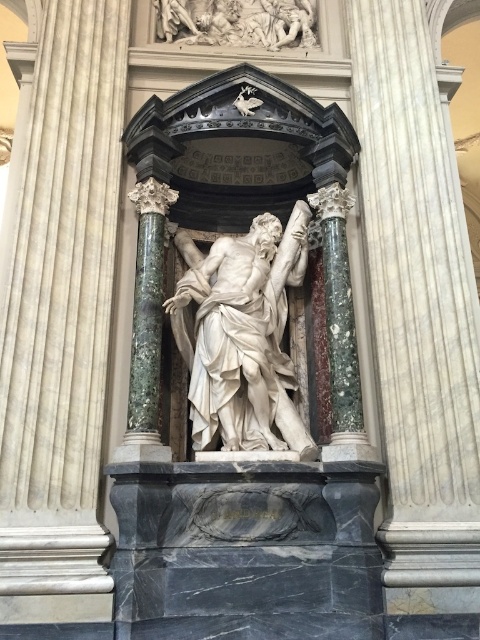
Question: Among these points, which one is farthest from the camera?

Choices:
 (A) (296, 268)
 (B) (108, 236)

Answer: (A)

Question: Considering the relative positions of white marble column at center and white marble statue at center in the image provided, where is white marble column at center located with respect to white marble statue at center?

Choices:
 (A) below
 (B) above

Answer: (B)

Question: Is white marble column at center behind white marble statue at center?

Choices:
 (A) yes
 (B) no

Answer: (A)

Question: Among these points, which one is farthest from the camera?

Choices:
 (A) (224, 436)
 (B) (87, 237)

Answer: (B)

Question: Which point is closer to the camera?

Choices:
 (A) white marble statue at center
 (B) white marble column at center

Answer: (A)

Question: Is white marble column at center wider than white marble statue at center?

Choices:
 (A) yes
 (B) no

Answer: (B)